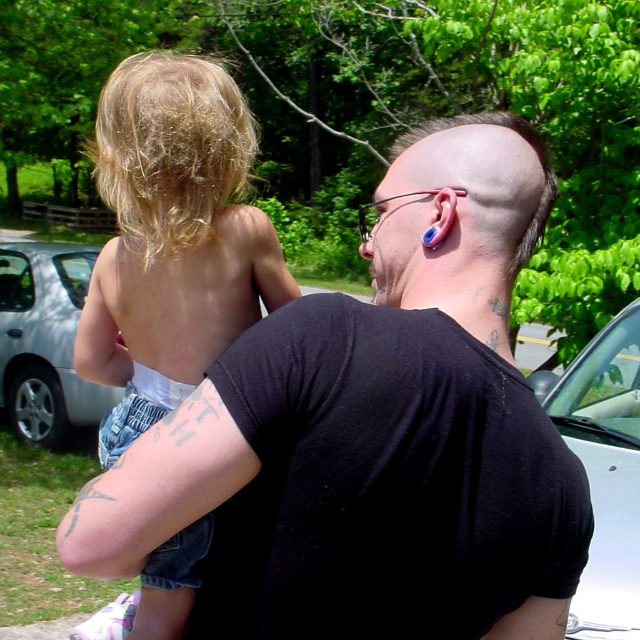
Based on the photo, you are standing in a park and see the black matte shirt at center and the silver metallic car at left. Which object is positioned to the right of the other?

The black matte shirt at center is positioned to the right of the silver metallic car at left.

You are a photographer trying to capture a photo of the silver metallic car at left while ensuring the black matte shirt at center is also visible. Based on their sizes, which object should you focus on first to ensure both are in frame?

The black matte shirt at center has a lesser width compared to silver metallic car at left, so you should focus on the silver metallic car at left first to ensure both fit in the frame.